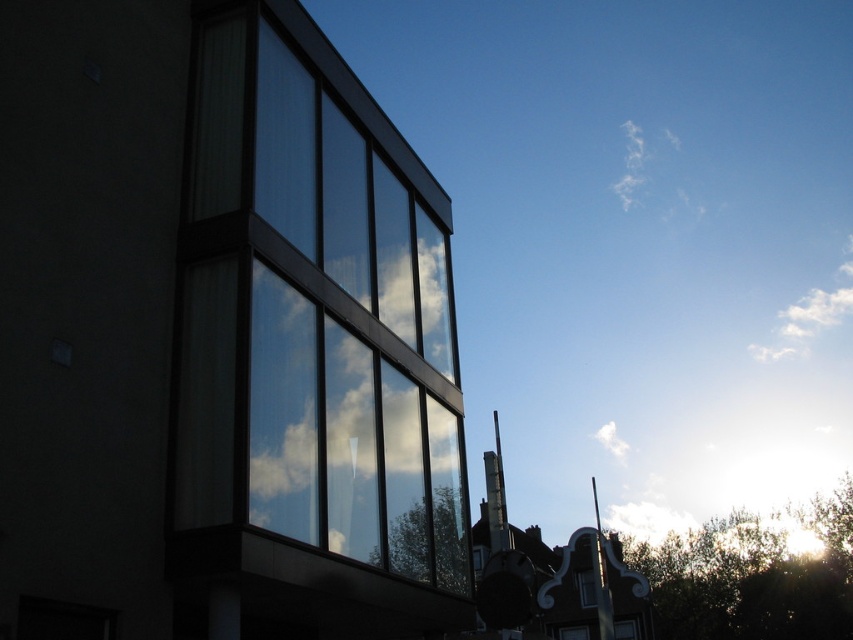
Question: Is transparent glass window at center smaller than white fluffy cloud at upper right?

Choices:
 (A) no
 (B) yes

Answer: (B)

Question: Which of the following is the closest to the observer?

Choices:
 (A) (318, 166)
 (B) (701, 209)

Answer: (A)

Question: Is transparent glass window at center to the left of white fluffy cloud at upper right from the viewer's perspective?

Choices:
 (A) no
 (B) yes

Answer: (B)

Question: Among these points, which one is farthest from the camera?

Choices:
 (A) (663, 134)
 (B) (291, 538)

Answer: (A)

Question: Is transparent glass window at center smaller than white fluffy cloud at upper right?

Choices:
 (A) no
 (B) yes

Answer: (B)